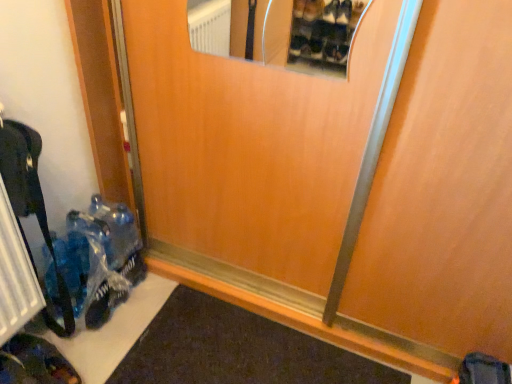
Question: Can you confirm if black metal radiator at lower left is thinner than dark brown leather shoe at lower left?

Choices:
 (A) yes
 (B) no

Answer: (A)

Question: From a real-world perspective, is black metal radiator at lower left beneath dark brown leather shoe at lower left?

Choices:
 (A) no
 (B) yes

Answer: (A)

Question: Is dark brown leather shoe at lower left surrounded by black metal radiator at lower left?

Choices:
 (A) yes
 (B) no

Answer: (B)

Question: Considering the relative sizes of black metal radiator at lower left and dark brown leather shoe at lower left in the image provided, is black metal radiator at lower left taller than dark brown leather shoe at lower left?

Choices:
 (A) yes
 (B) no

Answer: (A)

Question: From a real-world perspective, does black metal radiator at lower left stand above dark brown leather shoe at lower left?

Choices:
 (A) no
 (B) yes

Answer: (B)

Question: Could you tell me if black metal radiator at lower left is facing dark brown leather shoe at lower left?

Choices:
 (A) yes
 (B) no

Answer: (B)

Question: Would you say translucent plastic bag at lower left is a long distance from black metal radiator at lower left?

Choices:
 (A) no
 (B) yes

Answer: (A)

Question: Is translucent plastic bag at lower left placed right next to black metal radiator at lower left?

Choices:
 (A) yes
 (B) no

Answer: (B)

Question: Can you confirm if translucent plastic bag at lower left is taller than black metal radiator at lower left?

Choices:
 (A) yes
 (B) no

Answer: (B)

Question: Does translucent plastic bag at lower left have a lesser width compared to black metal radiator at lower left?

Choices:
 (A) no
 (B) yes

Answer: (A)

Question: Does translucent plastic bag at lower left turn towards black metal radiator at lower left?

Choices:
 (A) yes
 (B) no

Answer: (B)

Question: Is translucent plastic bag at lower left in front of black metal radiator at lower left?

Choices:
 (A) yes
 (B) no

Answer: (B)

Question: Are black metal radiator at lower left and wooden door at center located far from each other?

Choices:
 (A) yes
 (B) no

Answer: (B)